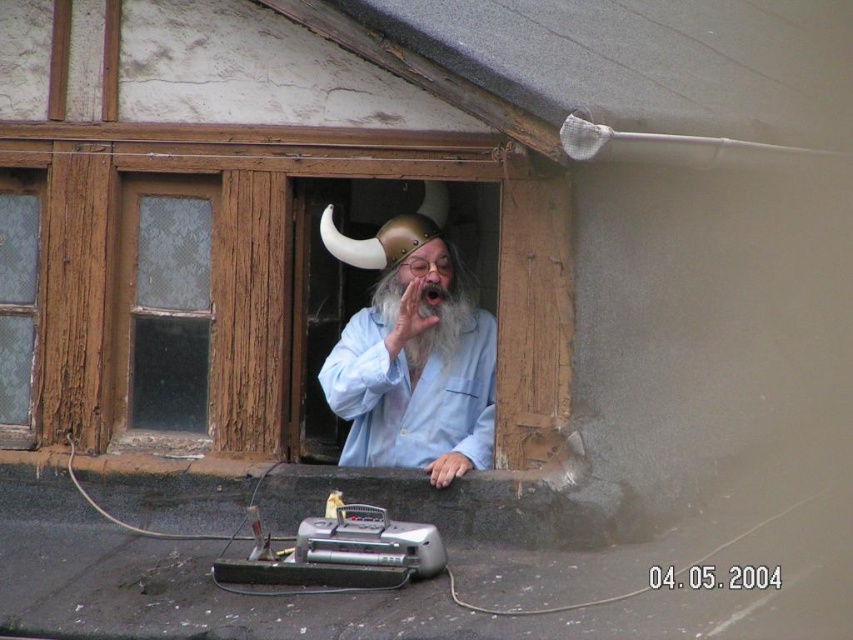
Question: Does matte gold helmet at center appear on the right side of clear glass window at left?

Choices:
 (A) yes
 (B) no

Answer: (A)

Question: In this image, where is matte gold helmet at center located relative to clear glass door at left?

Choices:
 (A) right
 (B) left

Answer: (A)

Question: Does matte gold helmet at center have a greater width compared to clear glass door at left?

Choices:
 (A) no
 (B) yes

Answer: (B)

Question: Which point is farther to the camera?

Choices:
 (A) (438, 264)
 (B) (9, 420)
 (C) (165, 324)

Answer: (B)

Question: Among these points, which one is farthest from the camera?

Choices:
 (A) [x=196, y=387]
 (B) [x=492, y=340]
 (C) [x=19, y=300]

Answer: (C)

Question: Which point appears closest to the camera in this image?

Choices:
 (A) (421, 280)
 (B) (25, 257)
 (C) (165, 435)

Answer: (A)